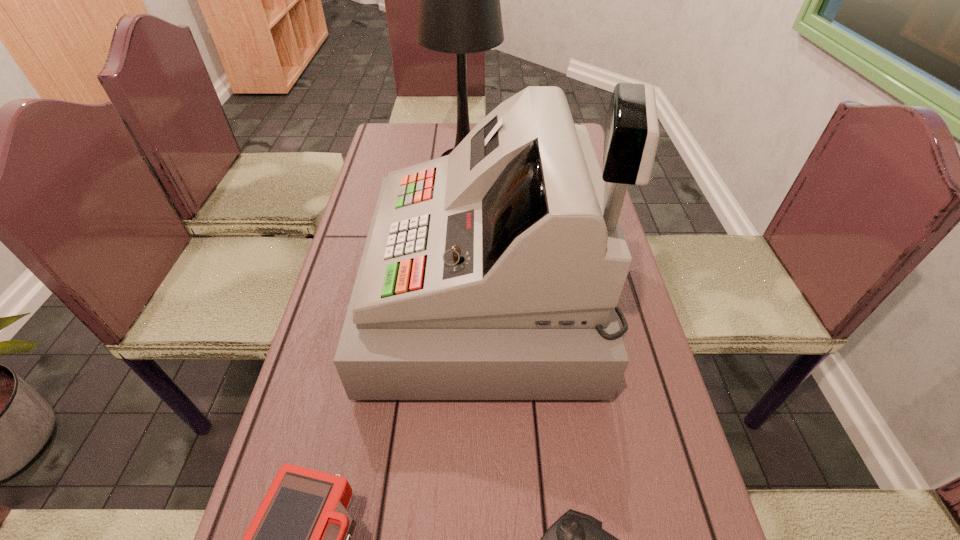
Locate an element on the screen. The width and height of the screenshot is (960, 540). object that is the nearest to the cash register is located at coordinates (300, 538).

Identify which object is the third closest to the cash register. Please provide its 2D coordinates. Your answer should be formatted as a tuple, i.e. [(x, y)], where the tuple contains the x and y coordinates of a point satisfying the conditions above.

[(576, 539)]